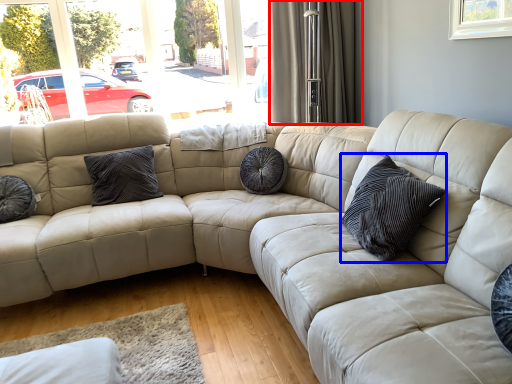
Question: Which object appears farthest to the camera in this image, curtain (highlighted by a red box) or pillow (highlighted by a blue box)?

Choices:
 (A) curtain
 (B) pillow

Answer: (A)